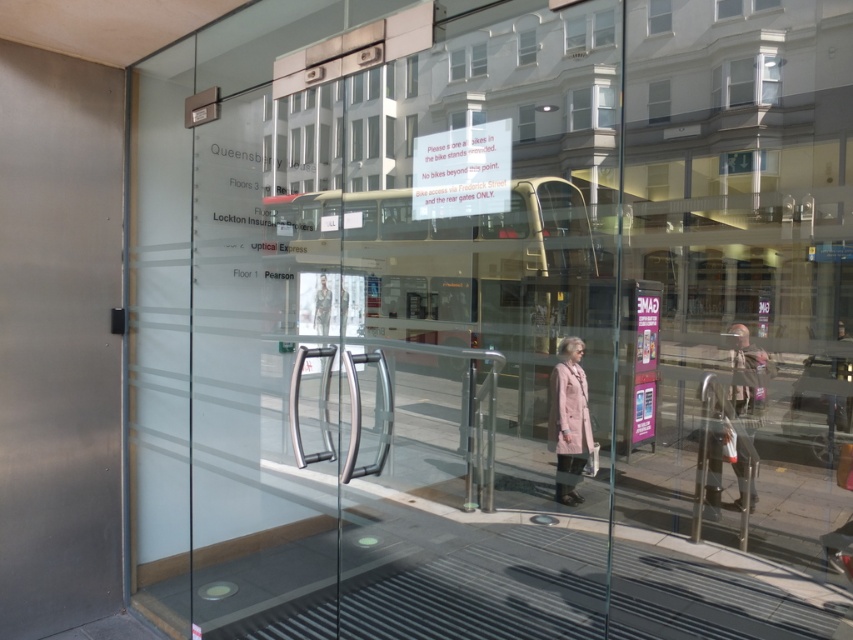
You are standing at the entrance of Queensberry House and want to take a photo of the point at coordinate (752, 428). If the camera you have can focus on objects up to 30 feet away, will it be able to capture the point clearly?

The point at coordinate (752, 428) is 27.40 feet away from the camera. Since the camera can focus up to 30 feet, it will be able to capture the point clearly.